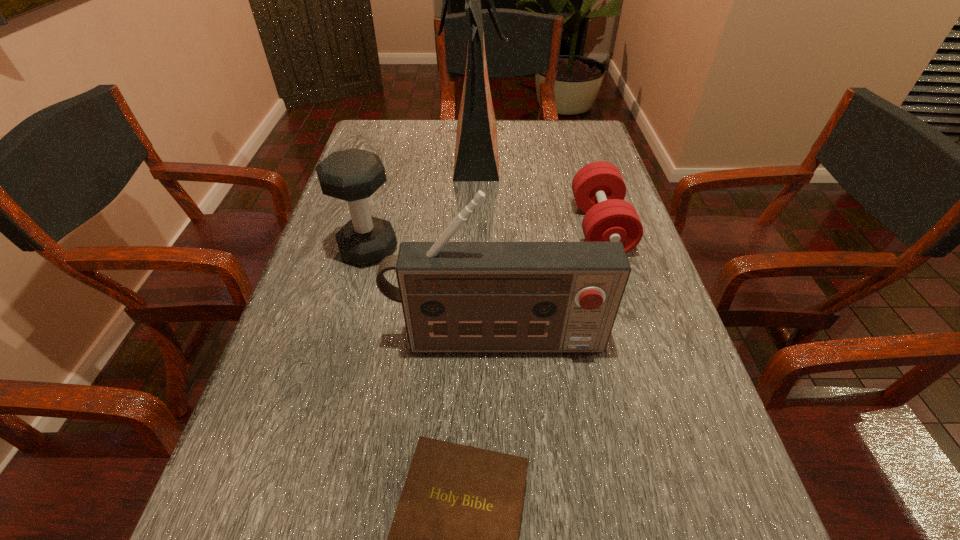
I want to click on free space located on the right of the taller dumbbell, so click(x=446, y=249).

At what (x,y) coordinates should I click in order to perform the action: click on vacant space located on the left of the right dumbbell. Please return your answer as a coordinate pair (x, y). Looking at the image, I should click on pos(521,228).

Find the location of a particular element. object that is at the far edge is located at coordinates (476, 153).

At what (x,y) coordinates should I click in order to perform the action: click on object that is at the left edge. Please return your answer as a coordinate pair (x, y). Looking at the image, I should click on (353, 175).

Find the location of `radio receiver at the right edge`. radio receiver at the right edge is located at coordinates (456, 296).

This screenshot has height=540, width=960. Find the location of `dumbbell that is at the right edge`. dumbbell that is at the right edge is located at coordinates (599, 190).

In the image, there is a desktop. Identify the location of vacant region at the far edge. (423, 124).

Image resolution: width=960 pixels, height=540 pixels. What are the coordinates of `vacant region at the left edge` in the screenshot? It's located at (315, 343).

Image resolution: width=960 pixels, height=540 pixels. I want to click on vacant region at the right edge, so click(x=730, y=524).

The image size is (960, 540). Find the location of `free space at the far left corner`. free space at the far left corner is located at coordinates (404, 148).